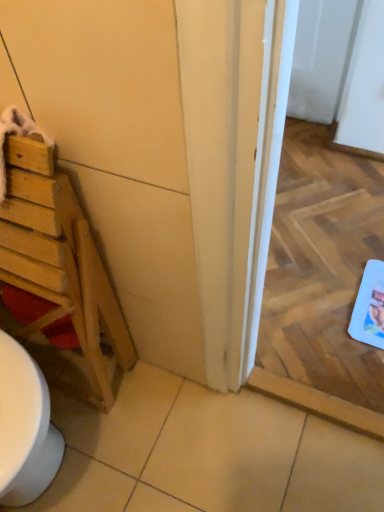
Question: Does white glossy screen door at center come in front of wooden door at left?

Choices:
 (A) yes
 (B) no

Answer: (B)

Question: Is wooden door at left surrounded by white glossy screen door at center?

Choices:
 (A) yes
 (B) no

Answer: (B)

Question: Are white glossy screen door at center and wooden door at left located far from each other?

Choices:
 (A) yes
 (B) no

Answer: (B)

Question: Does white glossy screen door at center have a greater width compared to wooden door at left?

Choices:
 (A) yes
 (B) no

Answer: (A)

Question: From a real-world perspective, does white glossy screen door at center stand above wooden door at left?

Choices:
 (A) yes
 (B) no

Answer: (B)

Question: From the image's perspective, relative to wooden door at left, is wooden ladder at left above or below?

Choices:
 (A) above
 (B) below

Answer: (B)

Question: Is point (36, 217) positioned closer to the camera than point (96, 58)?

Choices:
 (A) closer
 (B) farther

Answer: (B)

Question: Relative to wooden door at left, is wooden ladder at left in front or behind?

Choices:
 (A) behind
 (B) front

Answer: (A)

Question: In terms of height, does wooden ladder at left look taller or shorter compared to wooden door at left?

Choices:
 (A) short
 (B) tall

Answer: (A)

Question: Considering the positions of wooden door at left and white glossy screen door at center in the image, is wooden door at left wider or thinner than white glossy screen door at center?

Choices:
 (A) wide
 (B) thin

Answer: (B)

Question: In the image, is wooden door at left on the left side or the right side of white glossy screen door at center?

Choices:
 (A) left
 (B) right

Answer: (A)

Question: From the image's perspective, relative to white glossy screen door at center, is wooden door at left above or below?

Choices:
 (A) above
 (B) below

Answer: (B)

Question: From a real-world perspective, is wooden door at left physically located above or below white glossy screen door at center?

Choices:
 (A) above
 (B) below

Answer: (A)

Question: From the image's perspective, relative to white glossy screen door at center, is wooden ladder at left above or below?

Choices:
 (A) above
 (B) below

Answer: (B)

Question: Based on their positions, is wooden ladder at left located to the left or right of white glossy screen door at center?

Choices:
 (A) right
 (B) left

Answer: (B)